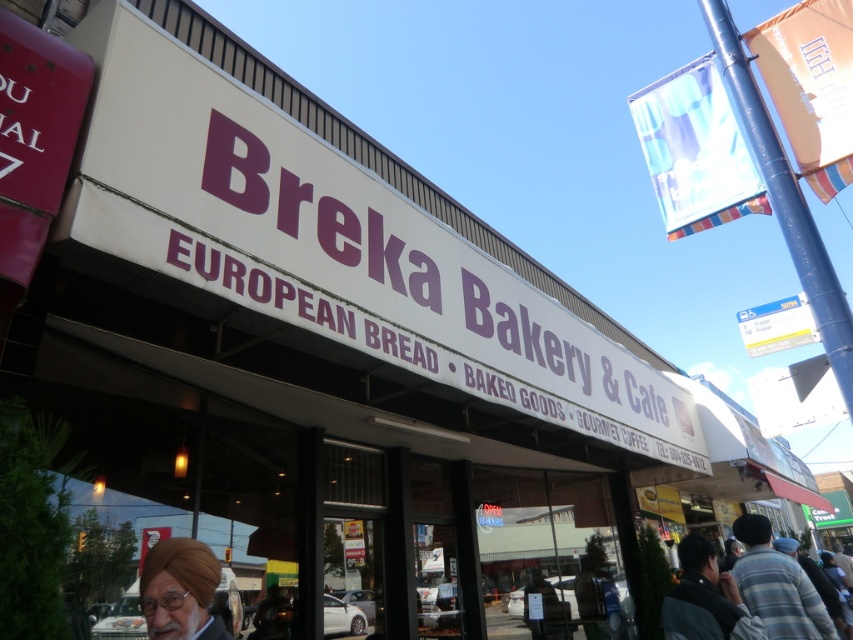
Question: Which point is closer to the camera taking this photo?

Choices:
 (A) (293, 236)
 (B) (820, 628)

Answer: (B)

Question: Which of the following is the closest to the observer?

Choices:
 (A) dark gray jacket at lower right
 (B) striped cotton shirt at lower right
 (C) matte brown turban at lower left
 (D) white matte sign at center

Answer: (C)

Question: Is striped cotton shirt at lower right bigger than dark gray jacket at lower right?

Choices:
 (A) no
 (B) yes

Answer: (B)

Question: Does matte brown turban at lower left come behind dark gray jacket at lower right?

Choices:
 (A) no
 (B) yes

Answer: (A)

Question: Is striped cotton shirt at lower right in front of dark gray jacket at lower right?

Choices:
 (A) yes
 (B) no

Answer: (B)

Question: Which object is closer to the camera taking this photo?

Choices:
 (A) white matte sign at center
 (B) striped cotton shirt at lower right
 (C) dark gray jacket at lower right

Answer: (C)